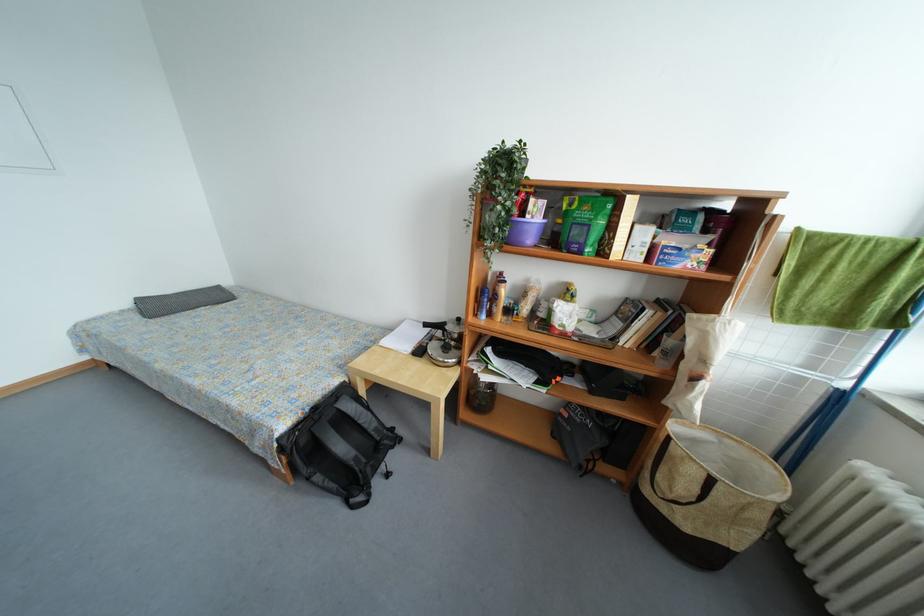
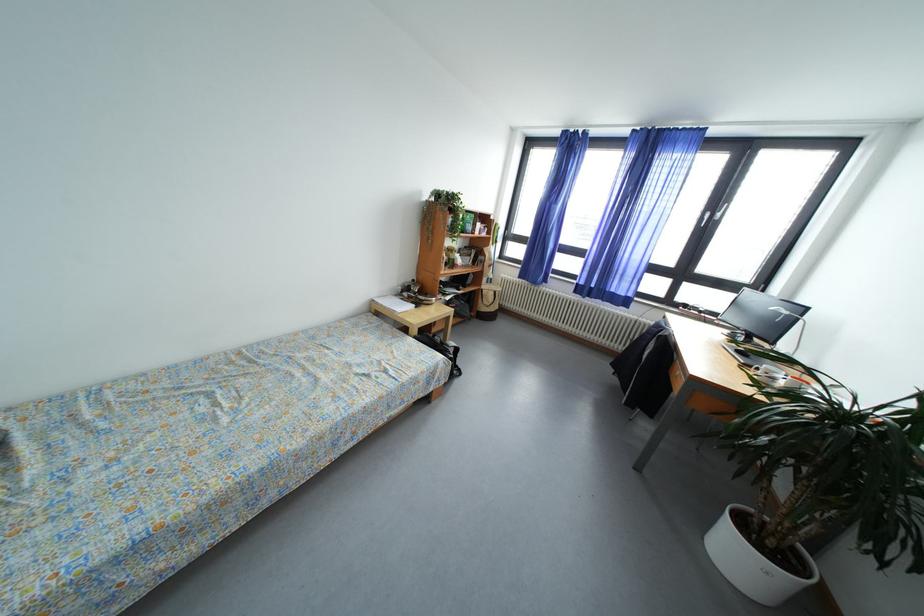
Find the pixel in the second image that matches [718,485] in the first image.

(502, 297)